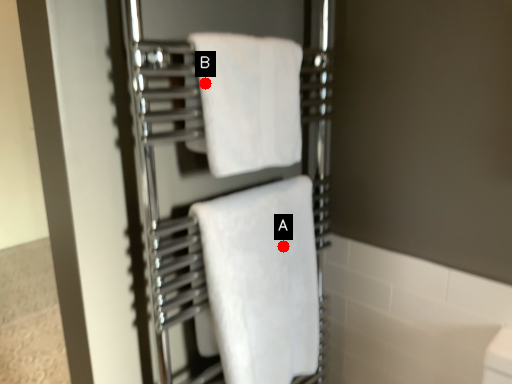
Question: Two points are circled on the image, labeled by A and B beside each circle. Which point is closer to the camera?

Choices:
 (A) A is closer
 (B) B is closer

Answer: (B)